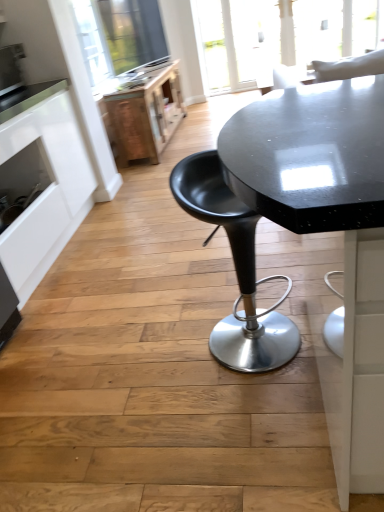
Question: Is black plastic stool at center shorter than satin silver toaster at upper left?

Choices:
 (A) yes
 (B) no

Answer: (B)

Question: Does black plastic stool at center have a greater width compared to satin silver toaster at upper left?

Choices:
 (A) no
 (B) yes

Answer: (B)

Question: Is black plastic stool at center thinner than satin silver toaster at upper left?

Choices:
 (A) no
 (B) yes

Answer: (A)

Question: Is black plastic stool at center completely or partially outside of satin silver toaster at upper left?

Choices:
 (A) no
 (B) yes

Answer: (B)

Question: Does black plastic stool at center appear on the right side of satin silver toaster at upper left?

Choices:
 (A) no
 (B) yes

Answer: (B)

Question: Is black plastic stool at center taller or shorter than wooden file cabinet at upper left?

Choices:
 (A) tall
 (B) short

Answer: (A)

Question: Considering the positions of black plastic stool at center and wooden file cabinet at upper left in the image, is black plastic stool at center wider or thinner than wooden file cabinet at upper left?

Choices:
 (A) thin
 (B) wide

Answer: (A)

Question: From a real-world perspective, relative to wooden file cabinet at upper left, is black plastic stool at center vertically above or below?

Choices:
 (A) below
 (B) above

Answer: (B)

Question: Is black plastic stool at center bigger or smaller than wooden file cabinet at upper left?

Choices:
 (A) small
 (B) big

Answer: (A)

Question: Would you say black plastic stool at center is inside or outside satin silver toaster at upper left?

Choices:
 (A) inside
 (B) outside

Answer: (B)

Question: Considering the relative positions of black plastic stool at center and satin silver toaster at upper left in the image provided, is black plastic stool at center to the left or to the right of satin silver toaster at upper left?

Choices:
 (A) left
 (B) right

Answer: (B)

Question: From the image's perspective, is black plastic stool at center located above or below satin silver toaster at upper left?

Choices:
 (A) above
 (B) below

Answer: (B)

Question: Is black plastic stool at center taller or shorter than satin silver toaster at upper left?

Choices:
 (A) tall
 (B) short

Answer: (A)

Question: From a real-world perspective, relative to white matte cabinet at left, is wooden file cabinet at upper left vertically above or below?

Choices:
 (A) above
 (B) below

Answer: (B)

Question: Is point (177, 119) positioned closer to the camera than point (16, 193)?

Choices:
 (A) farther
 (B) closer

Answer: (A)